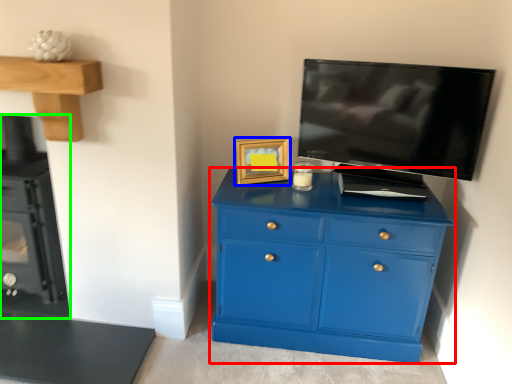
Question: Estimate the real-world distances between objects in this image. Which object is farther from chest of drawers (highlighted by a red box), picture frame (highlighted by a blue box) or appliance (highlighted by a green box)?

Choices:
 (A) picture frame
 (B) appliance

Answer: (B)